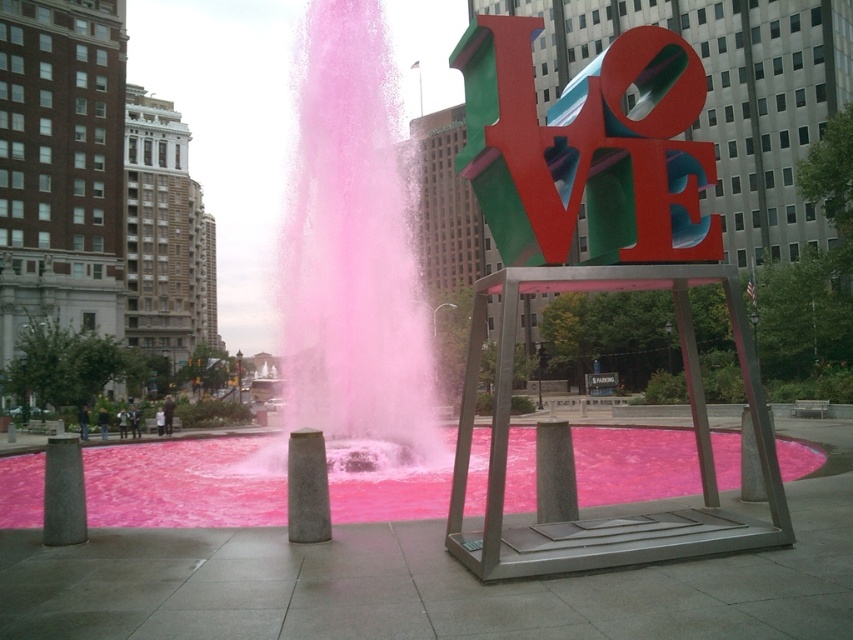
Is pink frosted water at center positioned before gray granite pillar at center?

No, pink frosted water at center is further to the viewer.

Is pink frosted water at center above gray granite pillar at center?

Yes.

What are the coordinates of `pink frosted water at center` in the screenshot? It's located at (352, 257).

Between pink liquid at fountain center and gray granite pillar at center, which one has less height?

gray granite pillar at center is shorter.

This screenshot has width=853, height=640. What do you see at coordinates (186, 483) in the screenshot?
I see `pink liquid at fountain center` at bounding box center [186, 483].

Image resolution: width=853 pixels, height=640 pixels. Identify the location of pink liquid at fountain center. (186, 483).

Is multicolored metallic sculpture at center further to camera compared to pink liquid at fountain center?

No.

Is multicolored metallic sculpture at center above pink liquid at fountain center?

Yes, multicolored metallic sculpture at center is above pink liquid at fountain center.

Which is in front, point (763, 436) or point (123, 515)?

Point (763, 436) is in front.

Locate an element on the screen. multicolored metallic sculpture at center is located at coordinates (595, 266).